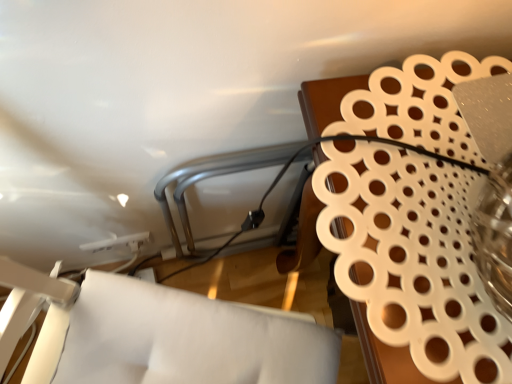
What is the approximate height of white perforated tray at upper right?

The height of white perforated tray at upper right is 75.63 centimeters.

Identify the location of white perforated tray at upper right. (410, 263).

Describe the element at coordinates (410, 263) in the screenshot. This screenshot has height=384, width=512. I see `white perforated tray at upper right` at that location.

Find the location of `white perforated tray at upper right`. white perforated tray at upper right is located at coordinates (410, 263).